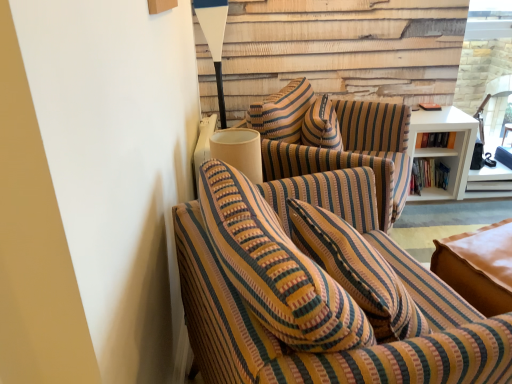
Describe the element at coordinates (319, 293) in the screenshot. I see `striped fabric couch at center, the 2th studio couch positioned from the back` at that location.

Find the location of a particular element. white glossy table lamp at upper center is located at coordinates (214, 40).

This screenshot has width=512, height=384. I want to click on striped fabric couch at center, the first studio couch positioned from the back, so click(335, 140).

What do you see at coordinates (428, 174) in the screenshot? Image resolution: width=512 pixels, height=384 pixels. I see `hardcover books at right, the 1th book in the bottom-to-top sequence` at bounding box center [428, 174].

Looking at this image, what is the approximate height of white matte shelf at right?

white matte shelf at right is 21.32 inches tall.

In order to click on clear glass door at upper right in this screenshot , I will do `click(486, 63)`.

Image resolution: width=512 pixels, height=384 pixels. What do you see at coordinates (486, 63) in the screenshot?
I see `clear glass door at upper right` at bounding box center [486, 63].

In order to click on hardcover books at upper right, which is counted as the first book, starting from the top in this screenshot , I will do `click(436, 140)`.

Is striped fabric couch at center, the 2th studio couch positioned from the back, located within white matte shelf at right?

No, striped fabric couch at center, the 2th studio couch positioned from the back, is located outside of white matte shelf at right.

From the image's perspective, between white matte shelf at right and striped fabric couch at center, the 2th studio couch positioned from the back, who is located below?

striped fabric couch at center, the 2th studio couch positioned from the back, from the image's perspective.

Does white matte shelf at right appear on the left side of striped fabric couch at center, which ranks as the first studio couch in front-to-back order?

Incorrect, white matte shelf at right is not on the left side of striped fabric couch at center, which ranks as the first studio couch in front-to-back order.

The height and width of the screenshot is (384, 512). What are the coordinates of `shelf below the striped fabric couch at center, which ranks as the first studio couch in front-to-back order (from a real-world perspective)` in the screenshot? It's located at (445, 148).

Considering the relative positions of striped fabric couch at center, the 2th studio couch positioned from the back, and white matte shelf at right in the image provided, is striped fabric couch at center, the 2th studio couch positioned from the back, behind white matte shelf at right?

No.

From the image's perspective, count 2nd studio couchs downward from the white matte shelf at right and point to it. Please provide its 2D coordinates.

[(319, 293)]

Is striped fabric couch at center, the 2th studio couch positioned from the back, spatially inside white matte shelf at right, or outside of it?

striped fabric couch at center, the 2th studio couch positioned from the back, is not inside white matte shelf at right, it's outside.

Considering the positions of point (330, 361) and point (448, 151), is point (330, 361) closer or farther from the camera than point (448, 151)?

Point (330, 361) is positioned closer to the camera compared to point (448, 151).

From the image's perspective, starting from the clear glass door at upper right, which book is the 1st one below? Please provide its 2D coordinates.

[(436, 140)]

Looking at the image, does clear glass door at upper right seem bigger or smaller compared to hardcover books at upper right, which is the second book in bottom-to-top order?

Clearly, clear glass door at upper right is larger in size than hardcover books at upper right, which is the second book in bottom-to-top order.

From a real-world perspective, is clear glass door at upper right positioned over hardcover books at upper right, which is the second book in bottom-to-top order, based on gravity?

Yes, from a real-world perspective, clear glass door at upper right is over hardcover books at upper right, which is the second book in bottom-to-top order

Is clear glass door at upper right facing towards hardcover books at upper right, which is counted as the first book, starting from the top?

No, clear glass door at upper right is not oriented towards hardcover books at upper right, which is counted as the first book, starting from the top.

Does white glossy table lamp at upper center have a smaller size compared to hardcover books at right, the 1th book in the bottom-to-top sequence?

No, white glossy table lamp at upper center is not smaller than hardcover books at right, the 1th book in the bottom-to-top sequence.

Is hardcover books at right, acting as the second book starting from the top, completely or partially inside white glossy table lamp at upper center?

Definitely not — hardcover books at right, acting as the second book starting from the top, is not inside white glossy table lamp at upper center.

Could you tell me if white glossy table lamp at upper center is turned towards hardcover books at right, the 1th book in the bottom-to-top sequence?

No.

In the image, is white glossy table lamp at upper center positioned in front of or behind hardcover books at right, the 1th book in the bottom-to-top sequence?

In the image, white glossy table lamp at upper center appears in front of hardcover books at right, the 1th book in the bottom-to-top sequence.

From the image's perspective, which one is positioned higher, striped fabric couch at center, which ranks as the first studio couch in front-to-back order, or hardcover books at upper right, which is counted as the first book, starting from the top?

From the image's view, hardcover books at upper right, which is counted as the first book, starting from the top, is above.

Consider the image. Could you measure the distance between striped fabric couch at center, the 2th studio couch positioned from the back, and hardcover books at upper right, which is the second book in bottom-to-top order?

They are 5.77 feet apart.

Is striped fabric couch at center, the 2th studio couch positioned from the back, inside the boundaries of hardcover books at upper right, which is the second book in bottom-to-top order, or outside?

striped fabric couch at center, the 2th studio couch positioned from the back, is located beyond the bounds of hardcover books at upper right, which is the second book in bottom-to-top order.

Who is smaller, striped fabric couch at center, the 2th studio couch positioned from the back, or hardcover books at upper right, which is the second book in bottom-to-top order?

With smaller size is hardcover books at upper right, which is the second book in bottom-to-top order.

Is clear glass door at upper right positioned beyond the bounds of striped fabric couch at center, positioned as the second studio couch in front-to-back order?

Absolutely, clear glass door at upper right is external to striped fabric couch at center, positioned as the second studio couch in front-to-back order.

How distant is clear glass door at upper right from striped fabric couch at center, positioned as the second studio couch in front-to-back order?

A distance of 39.17 inches exists between clear glass door at upper right and striped fabric couch at center, positioned as the second studio couch in front-to-back order.

From the image's perspective, between clear glass door at upper right and striped fabric couch at center, positioned as the second studio couch in front-to-back order, which one is located above?

clear glass door at upper right, from the image's perspective.

From a real-world perspective, between clear glass door at upper right and striped fabric couch at center, positioned as the second studio couch in front-to-back order, who is vertically higher?

clear glass door at upper right, from a real-world perspective.

Is white matte shelf at right positioned far away from striped fabric couch at center, positioned as the second studio couch in front-to-back order?

That's not correct — white matte shelf at right is a little close to striped fabric couch at center, positioned as the second studio couch in front-to-back order.

From the image's perspective, is white matte shelf at right beneath striped fabric couch at center, positioned as the second studio couch in front-to-back order?

No, from the image's perspective, white matte shelf at right is not below striped fabric couch at center, positioned as the second studio couch in front-to-back order.

Based on their sizes in the image, would you say white matte shelf at right is bigger or smaller than striped fabric couch at center, positioned as the second studio couch in front-to-back order?

white matte shelf at right is smaller than striped fabric couch at center, positioned as the second studio couch in front-to-back order.

Does point (464, 134) appear closer or farther from the camera than point (343, 145)?

Point (464, 134) is positioned farther from the camera compared to point (343, 145).

From the image's perspective, starting from the white matte shelf at right, which studio couch is the 2nd one below? Please provide its 2D coordinates.

[(319, 293)]

Identify the location of shelf lying on the right of striped fabric couch at center, the 2th studio couch positioned from the back. This screenshot has height=384, width=512. (445, 148).

Based on the photo, from the image, which object appears to be nearer to hardcover books at upper right, which is counted as the first book, starting from the top, striped fabric couch at center, positioned as the second studio couch in front-to-back order, or hardcover books at right, acting as the second book starting from the top?

hardcover books at right, acting as the second book starting from the top.

Estimate the real-world distances between objects in this image. Which object is further from clear glass door at upper right, striped fabric couch at center, the 2th studio couch positioned from the back, or hardcover books at upper right, which is counted as the first book, starting from the top?

Among the two, striped fabric couch at center, the 2th studio couch positioned from the back, is located further to clear glass door at upper right.

Looking at the image, which one is located further to clear glass door at upper right, striped fabric couch at center, the first studio couch positioned from the back, or white glossy table lamp at upper center?

white glossy table lamp at upper center lies further to clear glass door at upper right than the other object.

Which object lies nearer to the anchor point white matte shelf at right, clear glass door at upper right or striped fabric couch at center, positioned as the second studio couch in front-to-back order?

The object closer to white matte shelf at right is clear glass door at upper right.

In the scene shown: When comparing their distances from white glossy table lamp at upper center, does hardcover books at upper right, which is the second book in bottom-to-top order, or clear glass door at upper right seem further?

clear glass door at upper right is further to white glossy table lamp at upper center.

Looking at the image, which one is located closer to white matte shelf at right, striped fabric couch at center, the 2th studio couch positioned from the back, or hardcover books at right, the 1th book in the bottom-to-top sequence?

hardcover books at right, the 1th book in the bottom-to-top sequence, is closer to white matte shelf at right.

Based on their spatial positions, is hardcover books at upper right, which is counted as the first book, starting from the top, or hardcover books at right, acting as the second book starting from the top, closer to white glossy table lamp at upper center?

hardcover books at upper right, which is counted as the first book, starting from the top.

From the image, which object appears to be farther from hardcover books at right, the 1th book in the bottom-to-top sequence, hardcover books at upper right, which is counted as the first book, starting from the top, or white glossy table lamp at upper center?

white glossy table lamp at upper center is positioned further to the anchor hardcover books at right, the 1th book in the bottom-to-top sequence.

The width and height of the screenshot is (512, 384). Identify the location of book between clear glass door at upper right and hardcover books at right, acting as the second book starting from the top, in the up-down direction. (436, 140).

Find the location of a particular element. shelf situated between striped fabric couch at center, the first studio couch positioned from the back, and clear glass door at upper right from left to right is located at coordinates (445, 148).

I want to click on shelf between striped fabric couch at center, which ranks as the first studio couch in front-to-back order, and hardcover books at right, the 1th book in the bottom-to-top sequence, from front to back, so click(x=445, y=148).

What are the coordinates of `shelf located between striped fabric couch at center, the 2th studio couch positioned from the back, and hardcover books at upper right, which is the second book in bottom-to-top order, in the depth direction` in the screenshot? It's located at (445, 148).